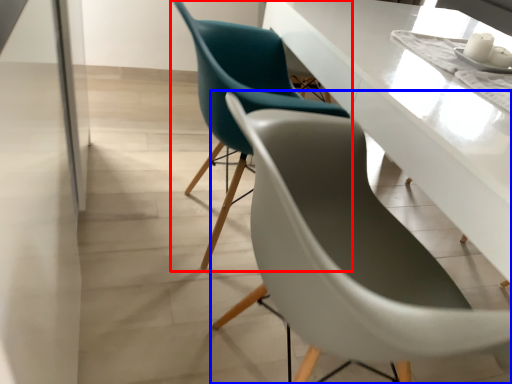
Question: Among these objects, which one is farthest to the camera, chair (highlighted by a red box) or chair (highlighted by a blue box)?

Choices:
 (A) chair
 (B) chair

Answer: (A)